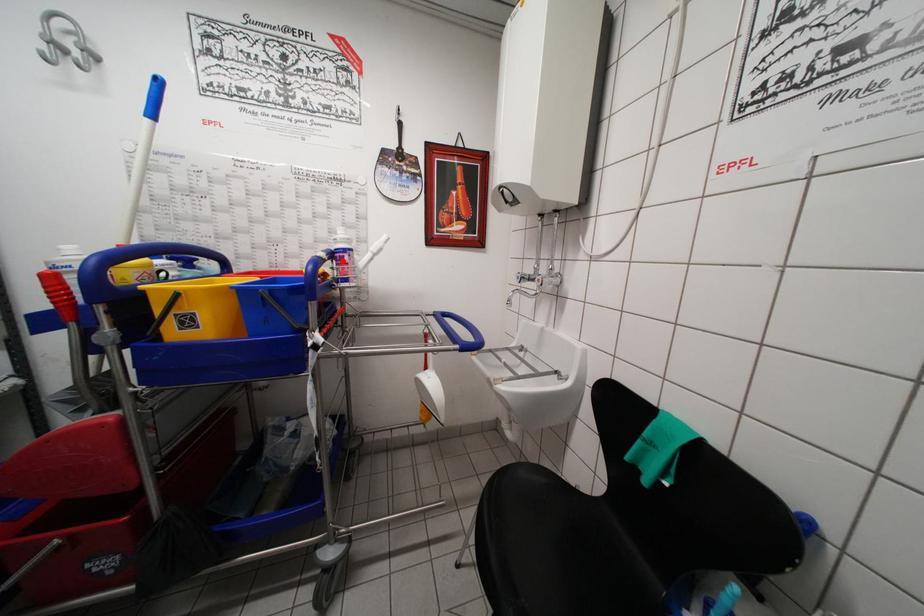
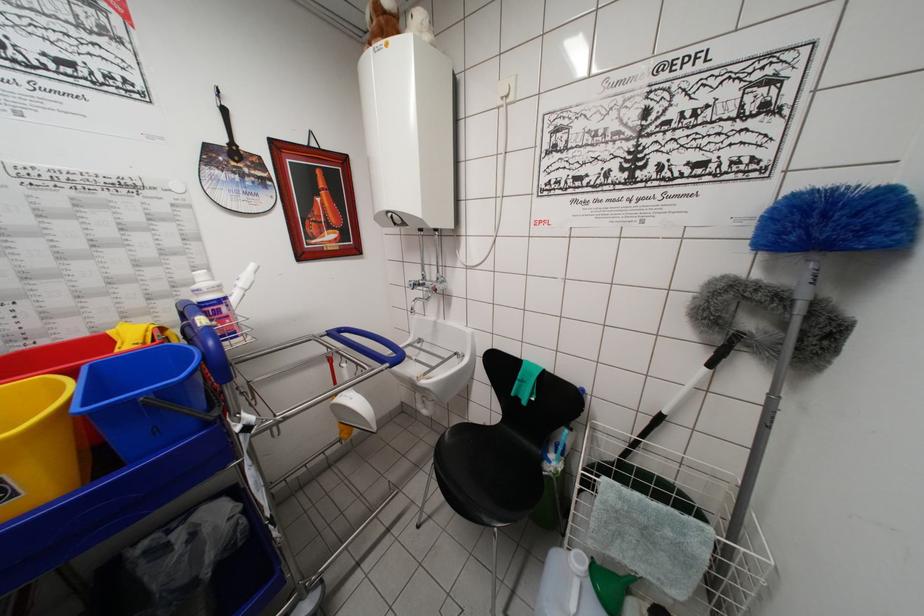
Where in the second image is the point corresponding to the highlighted location from the first image?

(215, 315)